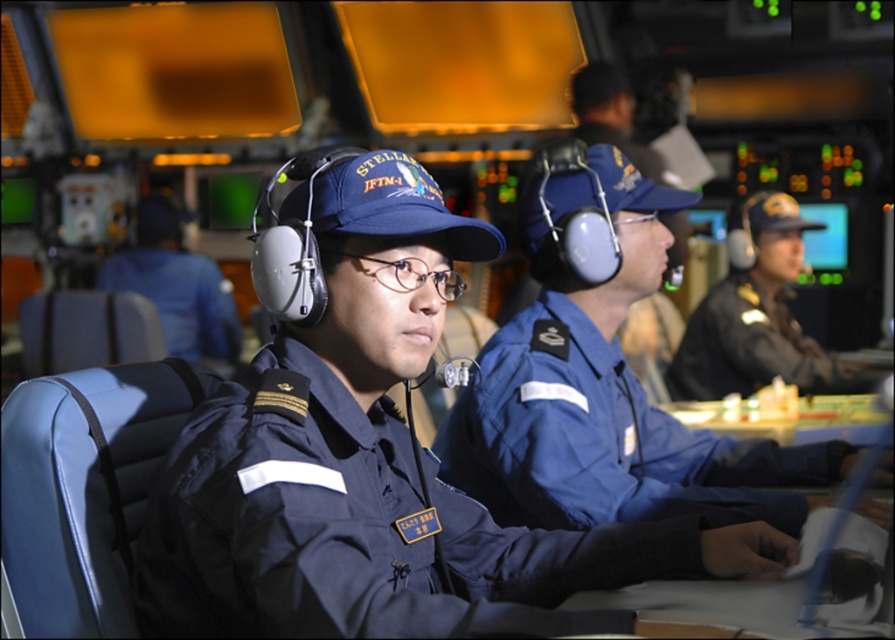
Question: Is dark blue fabric uniform at right bigger than blue uniform at center?

Choices:
 (A) no
 (B) yes

Answer: (B)

Question: Estimate the real-world distances between objects in this image. Which object is closer to the navy blue uniform at center?

Choices:
 (A) blue uniform at center
 (B) dark blue fabric uniform at right
 (C) blue fabric uniform at center

Answer: (C)

Question: Is navy blue uniform at center to the left of blue uniform at center from the viewer's perspective?

Choices:
 (A) yes
 (B) no

Answer: (B)

Question: Which point appears farthest from the camera in this image?

Choices:
 (A) (749, 358)
 (B) (565, 458)
 (C) (207, 307)
 (D) (330, 419)

Answer: (C)

Question: Does blue fabric uniform at center have a greater width compared to dark blue fabric uniform at right?

Choices:
 (A) yes
 (B) no

Answer: (A)

Question: Which of the following is the closest to the observer?

Choices:
 (A) (420, 545)
 (B) (142, 218)
 (C) (748, 474)

Answer: (A)